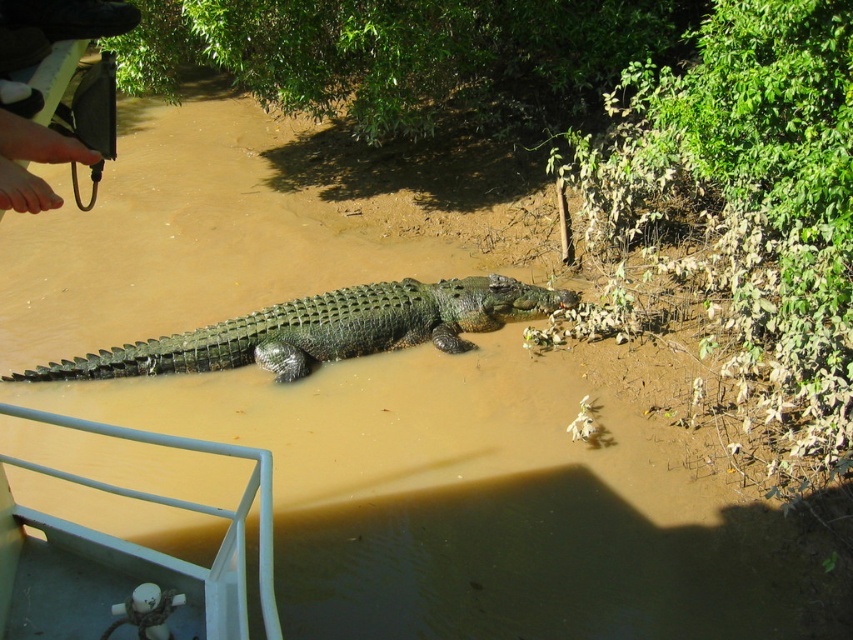
Who is more distant from viewer, [181,364] or [10,141]?

Point [181,364]

Which is more to the left, green scaly crocodile at center or brown leather shoe at upper left?

Positioned to the left is brown leather shoe at upper left.

This screenshot has height=640, width=853. Describe the element at coordinates (323, 330) in the screenshot. I see `green scaly crocodile at center` at that location.

This screenshot has height=640, width=853. Find the location of `green scaly crocodile at center`. green scaly crocodile at center is located at coordinates (323, 330).